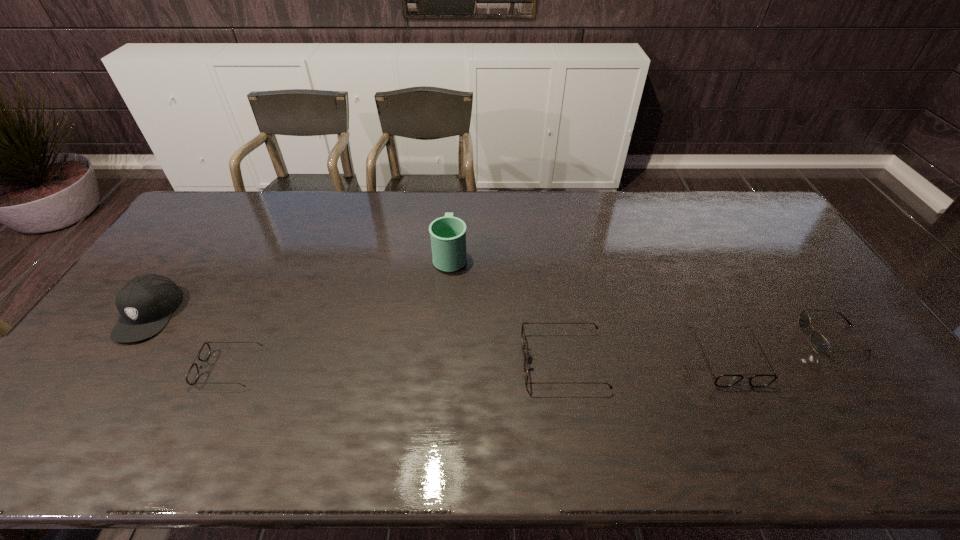
This screenshot has width=960, height=540. What are the coordinates of `free space for an extra sunglasses to achieve even spacing` in the screenshot? It's located at pos(397,365).